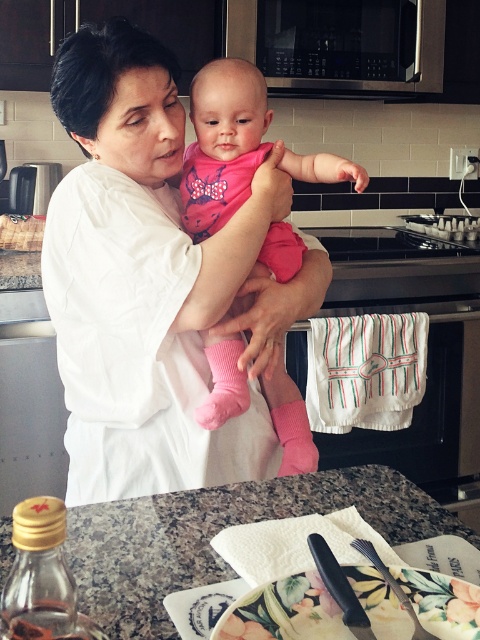
Question: Does white matte shirt at center appear over black plastic fork at lower center?

Choices:
 (A) no
 (B) yes

Answer: (B)

Question: In this image, where is white matte shirt at center located relative to pink fabric baby at center?

Choices:
 (A) right
 (B) left

Answer: (B)

Question: Does granite countertop at center appear over pink fabric baby at center?

Choices:
 (A) yes
 (B) no

Answer: (B)

Question: Considering the real-world distances, which object is farthest from the white matte shirt at center?

Choices:
 (A) pink fabric baby at center
 (B) black plastic fork at lower center
 (C) granite countertop at center

Answer: (B)

Question: Which of the following is the farthest from the observer?

Choices:
 (A) (367, 586)
 (B) (220, 352)

Answer: (B)

Question: Considering the real-world distances, which object is farthest from the pink fabric baby at center?

Choices:
 (A) white matte shirt at center
 (B) black plastic fork at lower center

Answer: (B)